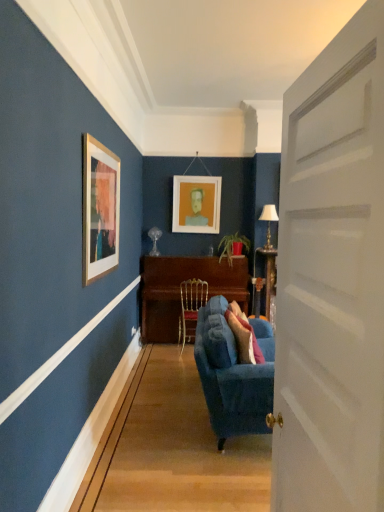
Measure the distance between point (206, 343) and camera.

A distance of 2.92 meters exists between point (206, 343) and camera.

Where is `white fabric lampshade at right`? Image resolution: width=384 pixels, height=512 pixels. white fabric lampshade at right is located at coordinates (269, 222).

Locate an element on the screen. This screenshot has height=512, width=384. lamp on the right of the wooden piano at center is located at coordinates (269, 222).

Who is shorter, wooden piano at center or white fabric lampshade at right?

white fabric lampshade at right is shorter.

Considering the positions of objects wooden piano at center and white fabric lampshade at right in the image provided, who is behind, wooden piano at center or white fabric lampshade at right?

wooden piano at center is further from the camera.

Which point is more distant from viewer, (205, 195) or (315, 226)?

Positioned behind is point (205, 195).

Is white matte picture frame at center further to camera compared to white matte door at center?

Yes, it is behind white matte door at center.

In the scene shown: Can you confirm if white matte picture frame at center is positioned to the right of white matte door at center?

Incorrect, white matte picture frame at center is not on the right side of white matte door at center.

Looking at the image, does white matte picture frame at center seem bigger or smaller compared to white matte door at center?

Considering their sizes, white matte picture frame at center takes up less space than white matte door at center.

Looking at this image, is white matte picture frame at center oriented away from velvet blue couch at center?

No, white matte picture frame at center is not facing the opposite direction of velvet blue couch at center.

Would you say white matte picture frame at center contains velvet blue couch at center?

No, velvet blue couch at center is not a part of white matte picture frame at center.

Is white matte picture frame at center with velvet blue couch at center?

There is a gap between white matte picture frame at center and velvet blue couch at center.

From a real-world perspective, which is physically above, white matte picture frame at center or velvet blue couch at center?

white matte picture frame at center, from a real-world perspective.

Is wooden piano at center behind gold metallic chair at center?

Yes, wooden piano at center is further from the viewer.

Which is more to the right, wooden piano at center or gold metallic chair at center?

From the viewer's perspective, wooden piano at center appears more on the right side.

Which is closer to the camera, [173,315] or [194,302]?

Point [173,315] is farther from the camera than point [194,302].

How different are the orientations of gold metallic chair at center and wooden piano at center in degrees?

The angle between the facing direction of gold metallic chair at center and the facing direction of wooden piano at center is 179 degrees.

Based on the photo, is gold metallic chair at center located outside wooden piano at center?

No, most part of gold metallic chair at center lies within wooden piano at center.

Is gold metallic chair at center facing towards wooden piano at center?

Yes, gold metallic chair at center is turned towards wooden piano at center.

Is gold metallic chair at center shorter than wooden piano at center?

Indeed, gold metallic chair at center has a lesser height compared to wooden piano at center.

From a real-world perspective, relative to white matte picture frame at center, is white fabric lampshade at right vertically above or below?

white fabric lampshade at right is situated lower than white matte picture frame at center in the real world.

Is white fabric lampshade at right to the left of white matte picture frame at center from the viewer's perspective?

No.

From a real-world perspective, is velvet blue couch at center over white matte picture frame at center?

→ No, from a real-world perspective, velvet blue couch at center is not above white matte picture frame at center.

This screenshot has width=384, height=512. In the image, there is a white matte picture frame at center. Identify the location of studio couch below it (from the image's perspective). (233, 374).

Looking at this image, are velvet blue couch at center and white matte picture frame at center far apart?

Yes, velvet blue couch at center is far from white matte picture frame at center.

Locate an element on the screen. lamp lying on the right of wooden piano at center is located at coordinates (269, 222).

Where is `picture frame positioned vertically above the white matte door at center (from a real-world perspective)`? This screenshot has width=384, height=512. picture frame positioned vertically above the white matte door at center (from a real-world perspective) is located at coordinates (196, 204).

Estimate the real-world distances between objects in this image. Which object is further from white fabric lampshade at right, white matte door at center or white matte picture frame at center?

The object further to white fabric lampshade at right is white matte door at center.

Considering their positions, is white matte door at center positioned further to white fabric lampshade at right than wooden piano at center?

Among the two, white matte door at center is located further to white fabric lampshade at right.

Which object lies nearer to the anchor point wooden piano at center, white fabric lampshade at right or white matte picture frame at center?

white matte picture frame at center lies closer to wooden piano at center than the other object.

When comparing their distances from wooden piano at center, does gold metallic chair at center or white matte door at center seem closer?

gold metallic chair at center is closer to wooden piano at center.

Based on the photo, estimate the real-world distances between objects in this image. Which object is closer to white fabric lampshade at right, velvet blue couch at center or gold metallic chair at center?

Among the two, gold metallic chair at center is located nearer to white fabric lampshade at right.

Based on the photo, from the image, which object appears to be nearer to wooden piano at center, white matte picture frame at center or gold metallic chair at center?

The object closer to wooden piano at center is gold metallic chair at center.

Based on their spatial positions, is velvet blue couch at center or wooden piano at center closer to white matte door at center?

velvet blue couch at center is positioned closer to the anchor white matte door at center.

Which object lies nearer to the anchor point velvet blue couch at center, white matte picture frame at center or gold metallic chair at center?

gold metallic chair at center is positioned closer to the anchor velvet blue couch at center.

Image resolution: width=384 pixels, height=512 pixels. I want to click on lamp between white matte picture frame at center and gold metallic chair at center in the vertical direction, so click(x=269, y=222).

Identify the location of lamp that lies between white matte picture frame at center and wooden piano at center from top to bottom. (269, 222).

The image size is (384, 512). I want to click on lamp between white matte door at center and wooden piano at center in the front-back direction, so click(x=269, y=222).

Where is `lamp between white matte door at center and white matte picture frame at center in the front-back direction`? This screenshot has height=512, width=384. lamp between white matte door at center and white matte picture frame at center in the front-back direction is located at coordinates (269, 222).